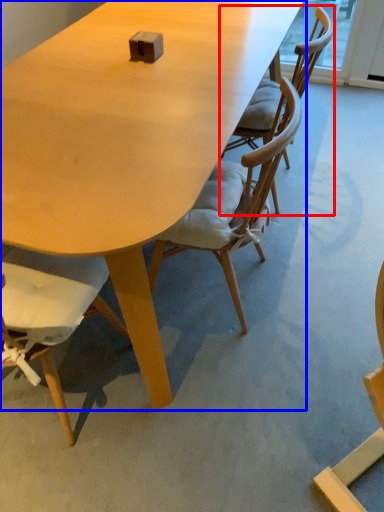
Question: Which point is closer to the camera, chair (highlighted by a red box) or table (highlighted by a blue box)?

Choices:
 (A) chair
 (B) table

Answer: (B)